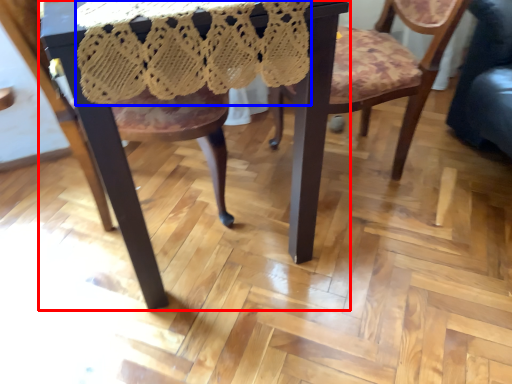
Question: Which of the following is the farthest to the observer, table (highlighted by a red box) or lace dress (highlighted by a blue box)?

Choices:
 (A) table
 (B) lace dress

Answer: (A)